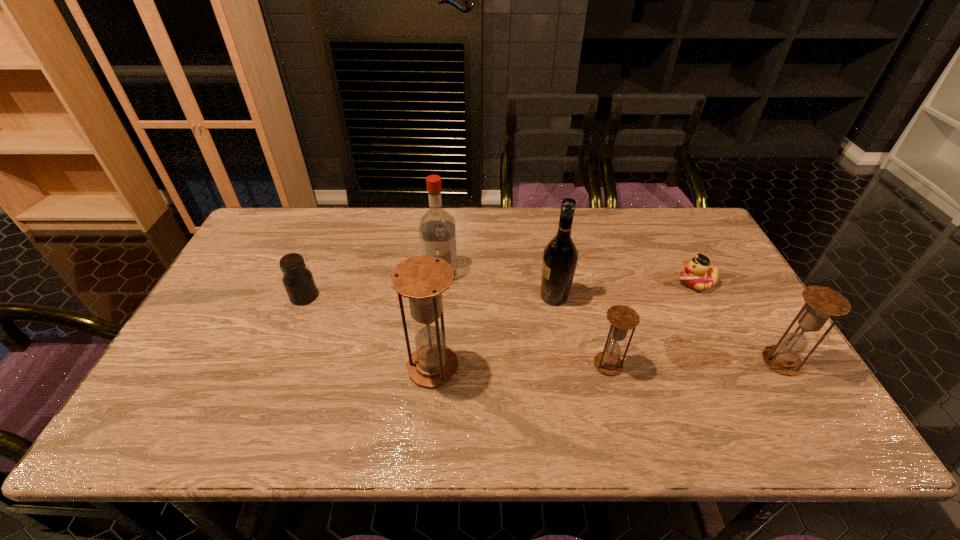
Please point a vacant point for placing a hourglass on the left. Please provide its 2D coordinates. Your answer should be formatted as a tuple, i.e. [(x, y)], where the tuple contains the x and y coordinates of a point satisfying the conditions above.

[(256, 370)]